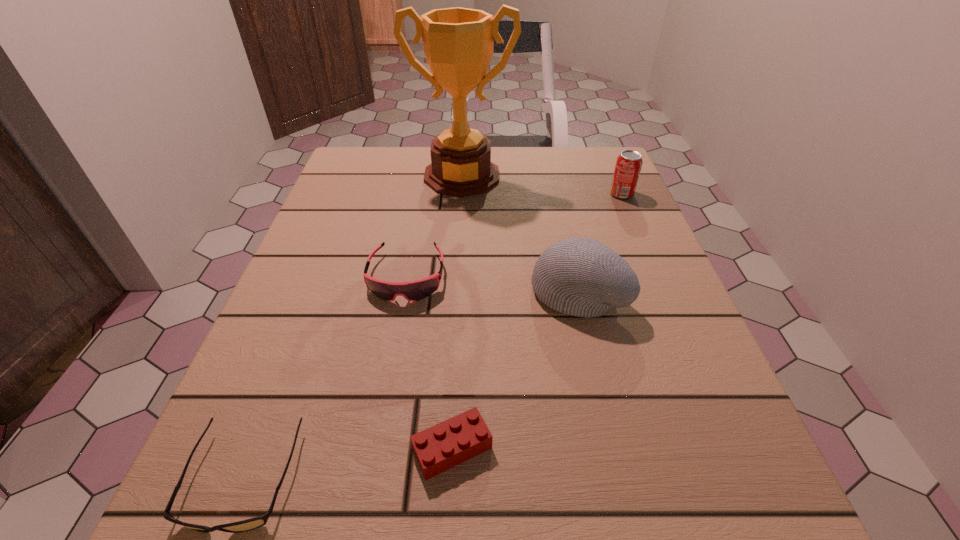
Image resolution: width=960 pixels, height=540 pixels. What are the coordinates of `object that can be found as the second closest to the Lego` in the screenshot? It's located at (582, 277).

Locate which object is the closest to the award. Please provide its 2D coordinates. Your answer should be formatted as a tuple, i.e. [(x, y)], where the tuple contains the x and y coordinates of a point satisfying the conditions above.

[(416, 290)]

This screenshot has width=960, height=540. I want to click on vacant space that satisfies the following two spatial constraints: 1. on the front-facing side of the rightmost object; 2. on the left side of the award, so click(461, 194).

Locate an element on the screen. This screenshot has width=960, height=540. free spot that satisfies the following two spatial constraints: 1. on the front-facing side of the third shortest object; 2. on the left side of the Lego is located at coordinates (375, 448).

The width and height of the screenshot is (960, 540). Identify the location of vacant region that satisfies the following two spatial constraints: 1. on the back side of the soda can; 2. on the left side of the beanie. (555, 194).

The image size is (960, 540). I want to click on vacant point that satisfies the following two spatial constraints: 1. on the front-facing side of the tallest object; 2. on the right side of the Lego, so click(445, 448).